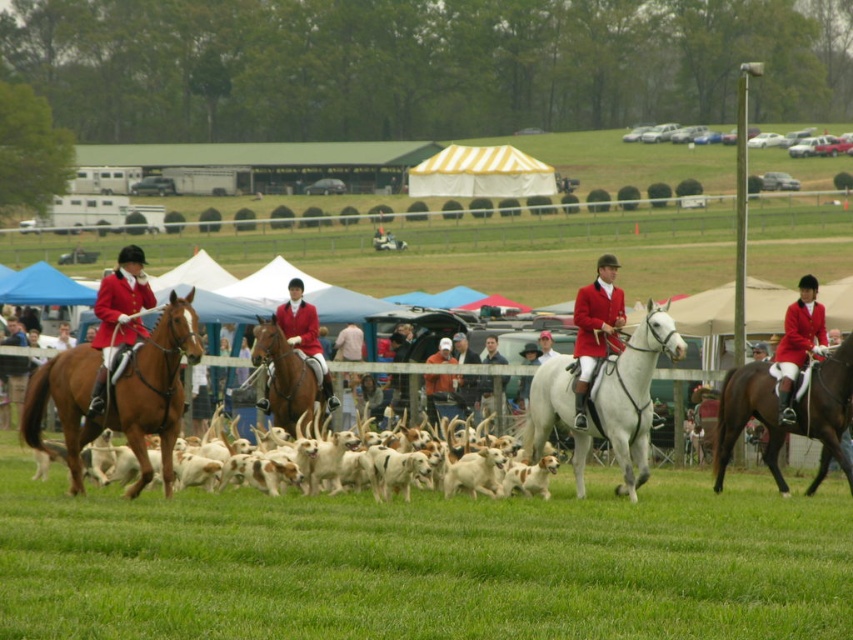
Question: Can you confirm if white glossy horse at center is positioned to the right of shiny brown horse at center?

Choices:
 (A) yes
 (B) no

Answer: (A)

Question: Which point is closer to the camera?

Choices:
 (A) (322, 404)
 (B) (775, 397)
 (C) (71, 481)
 (D) (579, 397)

Answer: (C)

Question: Does brown glossy horse at right have a lesser width compared to matte red jacket at right?

Choices:
 (A) no
 (B) yes

Answer: (B)

Question: Which object appears closest to the camera in this image?

Choices:
 (A) brown glossy horse at right
 (B) matte red jacket at center

Answer: (A)

Question: Does matte red jacket at left lie behind shiny brown horse at center?

Choices:
 (A) no
 (B) yes

Answer: (A)

Question: Estimate the real-world distances between objects in this image. Which object is closer to the white glossy horse at center?

Choices:
 (A) shiny brown horse at center
 (B) matte red jacket at left
 (C) matte red jacket at right
 (D) brown glossy horse at right

Answer: (D)